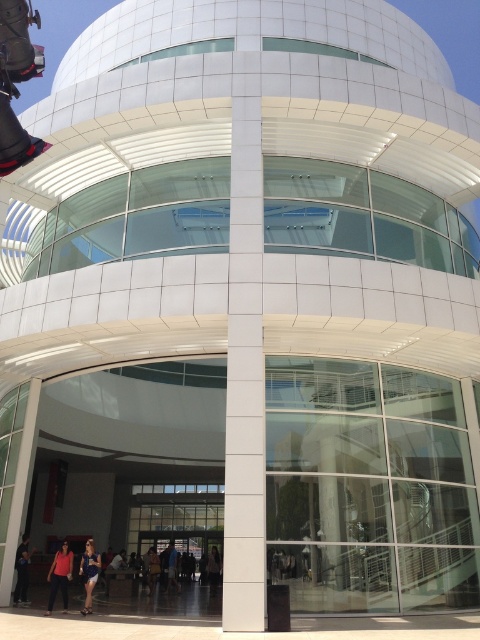
You are standing in front of the modern building and see a point marked at coordinates (88, 572). Based on the scene description, what object is located at that point?

The point at coordinates (88, 572) corresponds to blue denim shorts at lower left.

You are standing in front of the modern building and want to determine the relative positions of two points marked on its facade. The first point is located at coordinates point (56,563) and the second at point (213,588). Based on the building design described, which point is closer to you?

Point (56,563) is closer to the viewer than point (213,588).